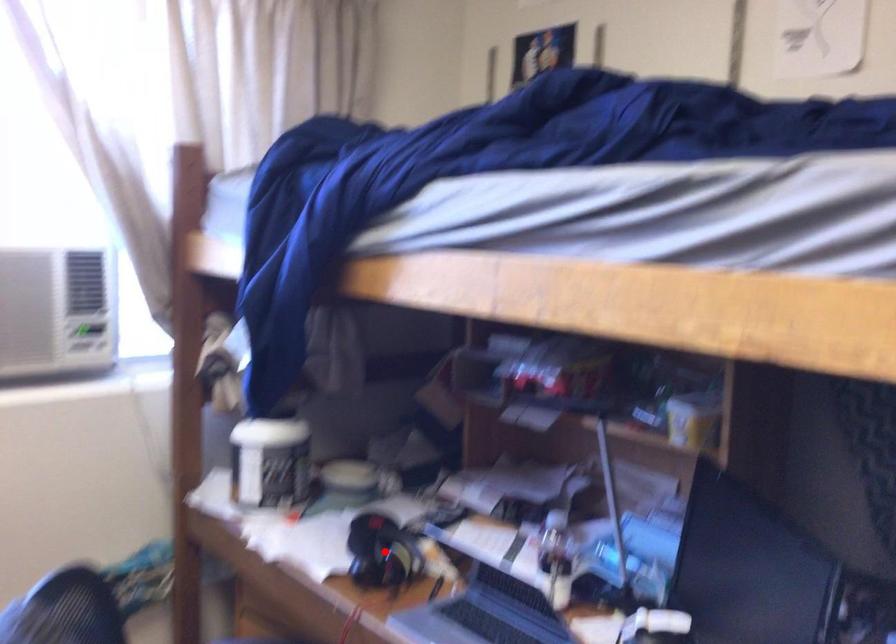
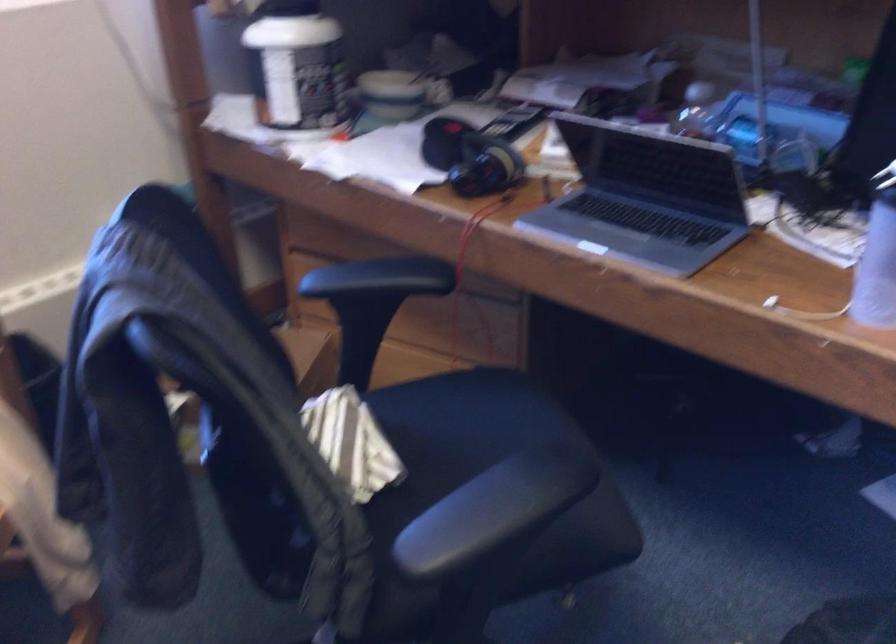
Locate, in the second image, the point that corresponds to the highlighted location in the first image.

(470, 158)